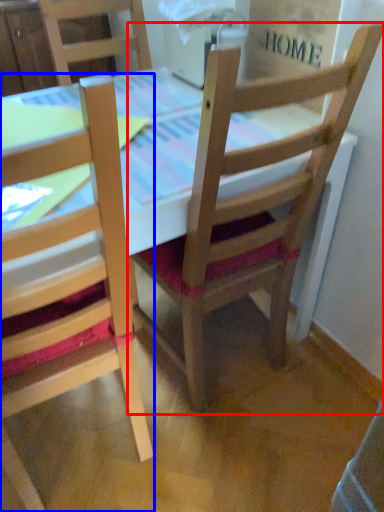
Question: Which point is further to the camera, chair (highlighted by a red box) or chair (highlighted by a blue box)?

Choices:
 (A) chair
 (B) chair

Answer: (A)